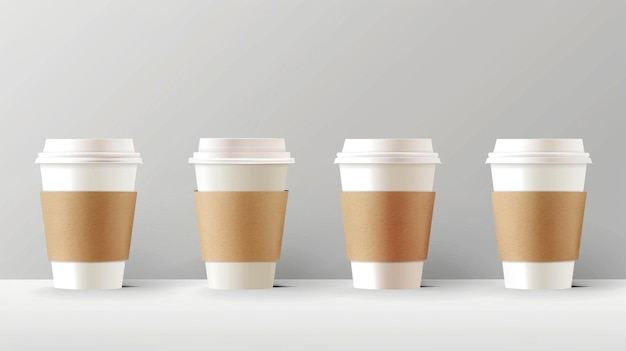
Where is `hot beverage cups`? The height and width of the screenshot is (351, 626). hot beverage cups is located at coordinates (98, 174), (217, 182), (387, 179), (526, 183).